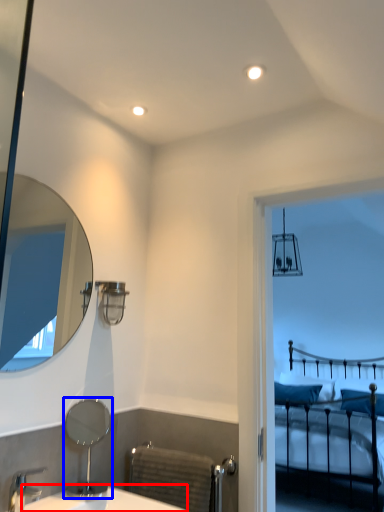
Question: Which object is closer to the camera taking this photo, counter top (highlighted by a red box) or mirror (highlighted by a blue box)?

Choices:
 (A) counter top
 (B) mirror

Answer: (A)